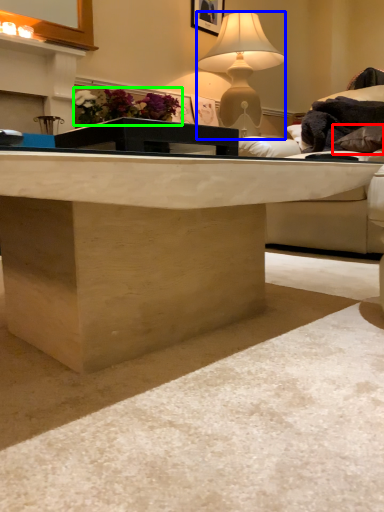
Question: Which object is positioned closest to pillow (highlighted by a red box)? Select from lamp (highlighted by a blue box) and flower (highlighted by a green box).

Choices:
 (A) lamp
 (B) flower

Answer: (A)